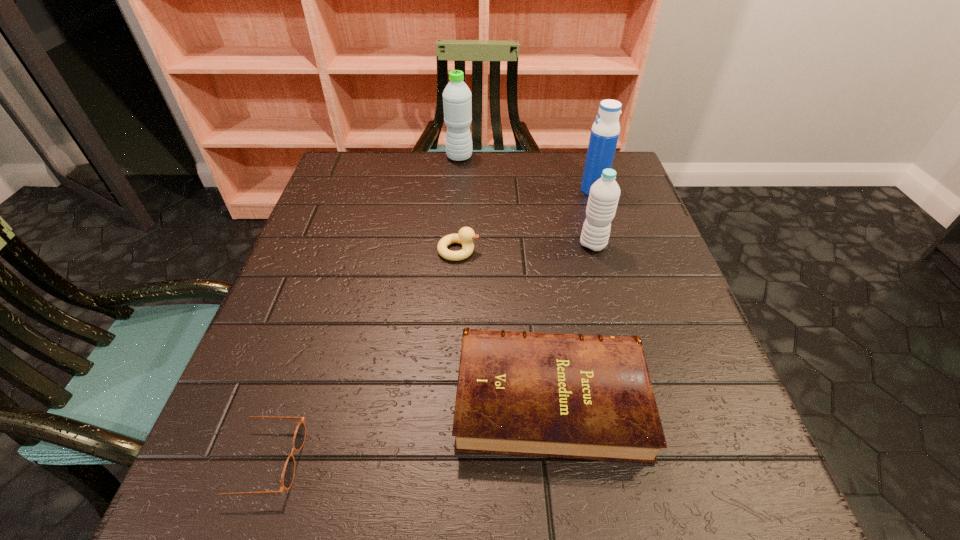
Locate an element on the screen. This screenshot has height=540, width=960. object at the far right corner is located at coordinates (605, 131).

Identify the location of object that is positioned at the near right corner. This screenshot has width=960, height=540. (590, 397).

This screenshot has width=960, height=540. I want to click on vacant region at the far edge of the desktop, so click(479, 192).

You are a GUI agent. You are given a task and a screenshot of the screen. Output one action in this format:
    pyautogui.click(x=<x>, y=<y>)
    Task: Click on the free space at the near edge of the desktop
    This screenshot has height=540, width=960.
    Given the screenshot: What is the action you would take?
    (336, 474)

In the image, there is a desktop. Identify the location of vacant space at the left edge. The height and width of the screenshot is (540, 960). (339, 340).

In the image, there is a desktop. Identify the location of free space at the right edge. (658, 238).

In the image, there is a desktop. Where is `free space at the far left corner`? free space at the far left corner is located at coordinates (345, 183).

The width and height of the screenshot is (960, 540). I want to click on vacant region at the near left corner, so click(252, 501).

Image resolution: width=960 pixels, height=540 pixels. I want to click on vacant space at the far right corner of the desktop, so click(x=567, y=167).

Find the location of a particular element. The height and width of the screenshot is (540, 960). vacant point located between the hardback book and the duckling is located at coordinates (504, 324).